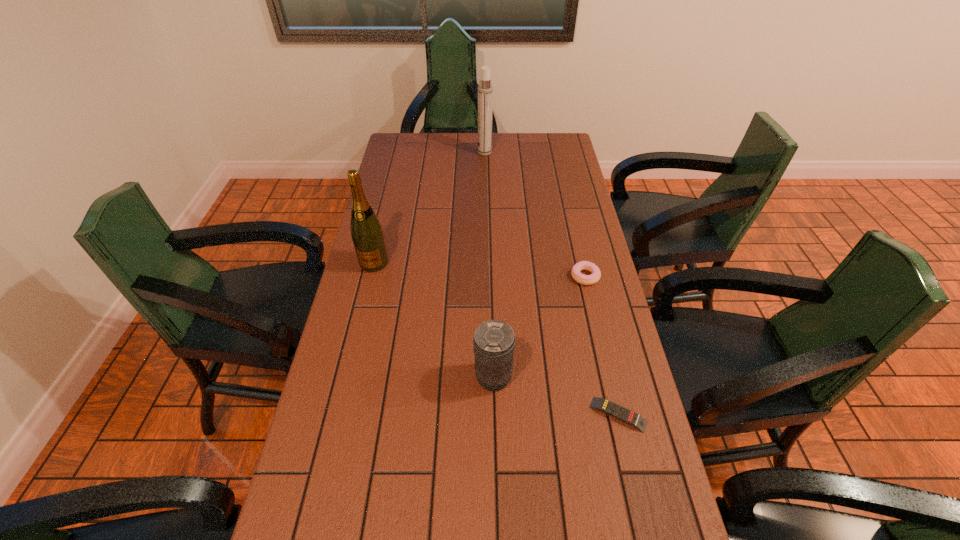
Where is `object that is the closest one to the remote control`? The width and height of the screenshot is (960, 540). object that is the closest one to the remote control is located at coordinates (494, 341).

Identify the location of object that is the nearest to the wine bottle. (494, 341).

This screenshot has height=540, width=960. I want to click on free spot that satisfies the following two spatial constraints: 1. on the front side of the farthest object; 2. on the right side of the nearest object, so click(x=489, y=415).

This screenshot has height=540, width=960. I want to click on vacant space that satisfies the following two spatial constraints: 1. on the side of the telephoto lens where the control switches are located; 2. on the right side of the nearest object, so click(x=493, y=415).

I want to click on free location that satisfies the following two spatial constraints: 1. on the front-facing side of the remote control; 2. on the left side of the wine bottle, so click(x=337, y=415).

At what (x,y) coordinates should I click in order to perform the action: click on vacant space that satisfies the following two spatial constraints: 1. on the side of the second nearest object where the control switches are located; 2. on the left side of the shortest object. Please return your answer as a coordinate pair (x, y). The width and height of the screenshot is (960, 540). Looking at the image, I should click on (493, 415).

The height and width of the screenshot is (540, 960). Identify the location of vacant space that satisfies the following two spatial constraints: 1. on the side of the nearest object where the control switches are located; 2. on the right side of the telephoto lens. (493, 415).

Where is `free spot that satisfies the following two spatial constraints: 1. on the front-facing side of the second shortest object; 2. on the right side of the leftmost object`? free spot that satisfies the following two spatial constraints: 1. on the front-facing side of the second shortest object; 2. on the right side of the leftmost object is located at coordinates (371, 276).

At what (x,y) coordinates should I click in order to perform the action: click on blank area in the image that satisfies the following two spatial constraints: 1. on the front-facing side of the leftmost object; 2. on the right side of the remote control. Please return your answer as a coordinate pair (x, y). Image resolution: width=960 pixels, height=540 pixels. Looking at the image, I should click on (337, 415).